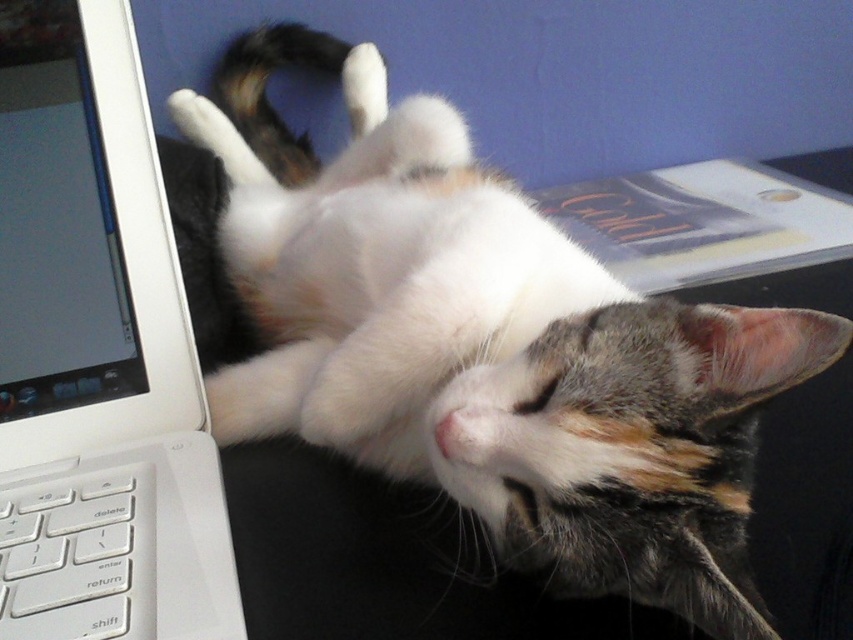
Question: Can you confirm if white plastic laptop at left is positioned to the left of white plastic keyboard at lower left?

Choices:
 (A) yes
 (B) no

Answer: (A)

Question: Which point is farther to the camera?

Choices:
 (A) white plastic laptop at left
 (B) white plastic keyboard at lower left

Answer: (B)

Question: Is white plastic laptop at left above white plastic keyboard at lower left?

Choices:
 (A) yes
 (B) no

Answer: (A)

Question: Which point is closer to the camera?

Choices:
 (A) (149, 589)
 (B) (78, 208)

Answer: (A)

Question: Can you confirm if white plastic laptop at left is positioned to the right of white plastic keyboard at lower left?

Choices:
 (A) yes
 (B) no

Answer: (B)

Question: Among these objects, which one is farthest from the camera?

Choices:
 (A) white plastic laptop at left
 (B) white plastic keyboard at lower left

Answer: (B)